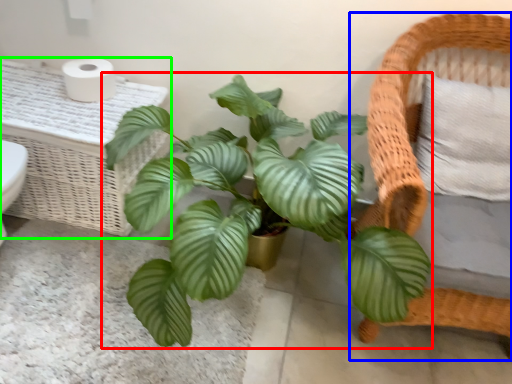
Question: Considering the real-world distances, which object is farthest from houseplant (highlighted by a red box)? furniture (highlighted by a blue box) or table (highlighted by a green box)?

Choices:
 (A) furniture
 (B) table

Answer: (B)